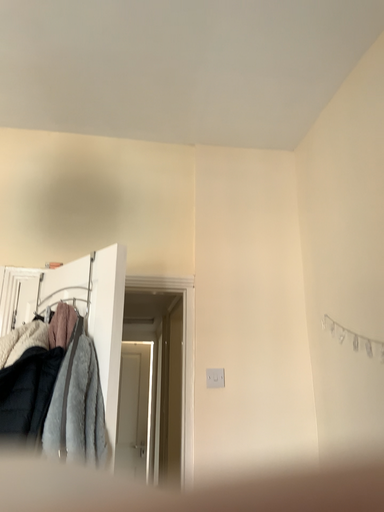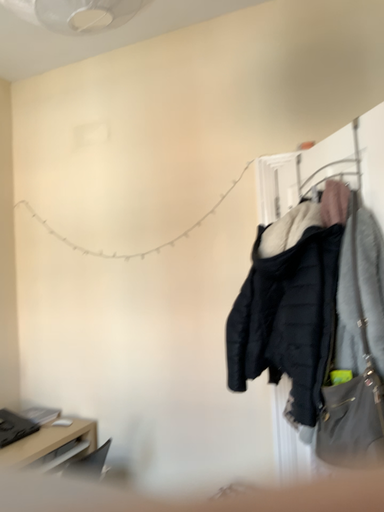
Question: Which way did the camera rotate in the video?

Choices:
 (A) rotated downward
 (B) rotated upward

Answer: (A)